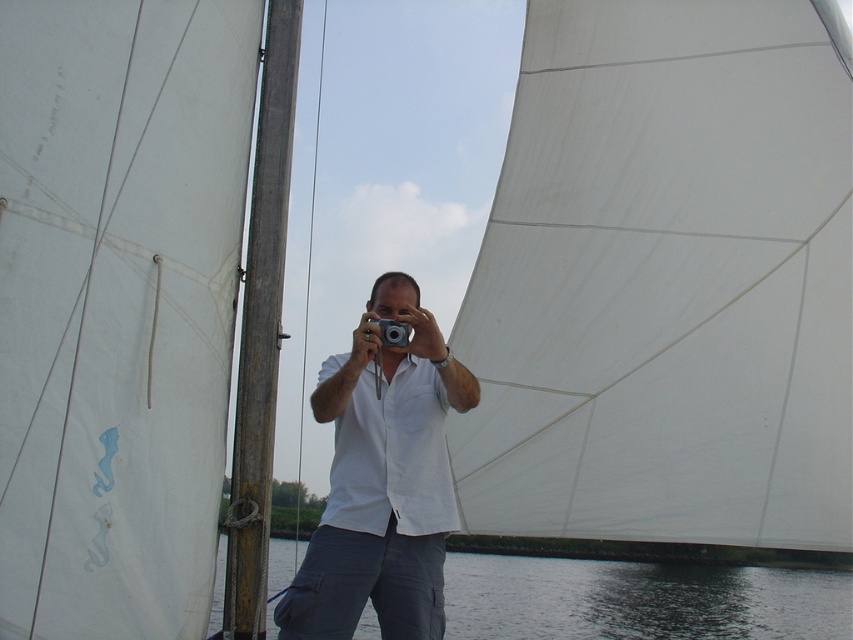
Question: Does dark blue water at lower center have a larger size compared to silver metallic camera at center?

Choices:
 (A) no
 (B) yes

Answer: (B)

Question: Is white cotton shirt at center positioned before dark blue water at lower center?

Choices:
 (A) yes
 (B) no

Answer: (B)

Question: Estimate the real-world distances between objects in this image. Which object is farther from the white cotton shirt at center?

Choices:
 (A) silver metallic camera at center
 (B) dark blue water at lower center

Answer: (B)

Question: Which object is the farthest from the silver metallic camera at center?

Choices:
 (A) white cotton shirt at center
 (B) dark blue water at lower center

Answer: (B)

Question: Is white cotton shirt at center above dark blue water at lower center?

Choices:
 (A) no
 (B) yes

Answer: (B)

Question: Estimate the real-world distances between objects in this image. Which object is farther from the silver metallic camera at center?

Choices:
 (A) white cotton shirt at center
 (B) dark blue water at lower center

Answer: (B)